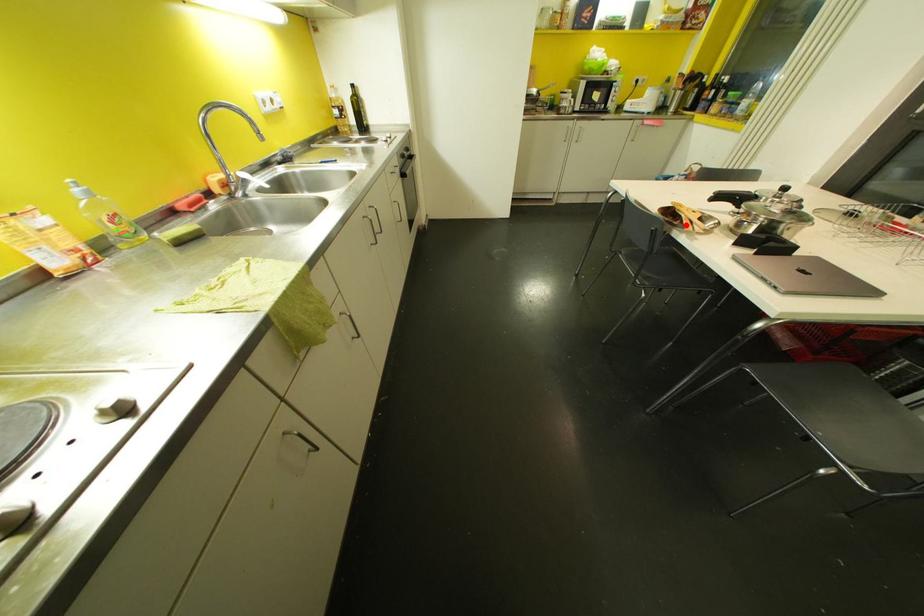
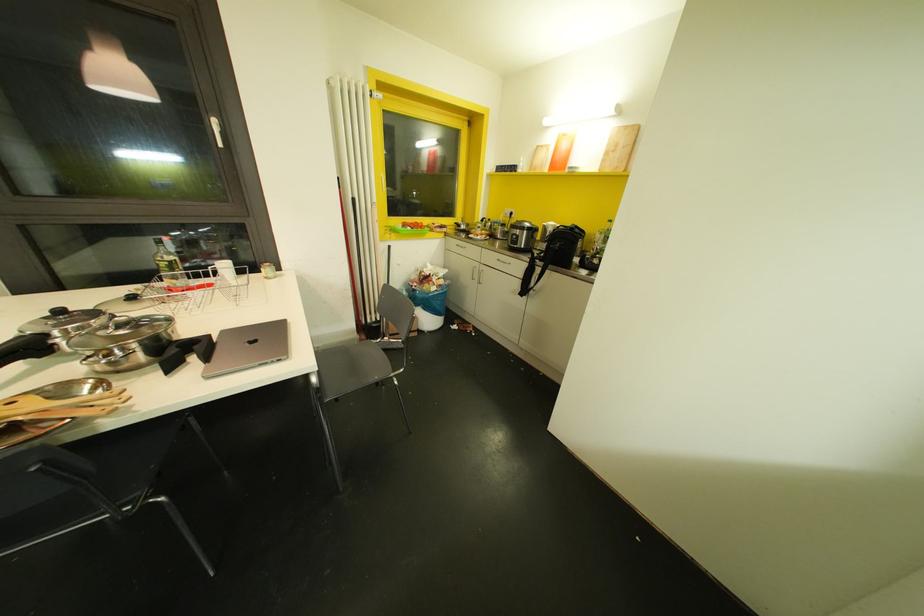
Where in the second image is the point corresponding to the highlighted location from the first image?

(82, 413)